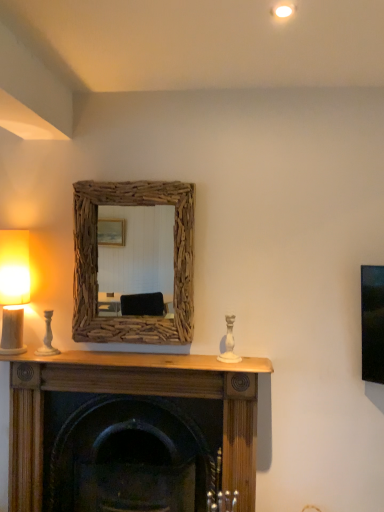
Question: Considering the relative positions of matte white table lamp at left and driftwood mirror at center in the image provided, is matte white table lamp at left to the left or to the right of driftwood mirror at center?

Choices:
 (A) left
 (B) right

Answer: (A)

Question: Based on their sizes in the image, would you say matte white table lamp at left is bigger or smaller than driftwood mirror at center?

Choices:
 (A) big
 (B) small

Answer: (B)

Question: Which object is the closest to the matte white table lamp at left?

Choices:
 (A) driftwood mirror at center
 (B) wooden fireplace at center

Answer: (A)

Question: Which object is the closest to the matte white table lamp at left?

Choices:
 (A) wooden fireplace at center
 (B) driftwood mirror at center

Answer: (B)